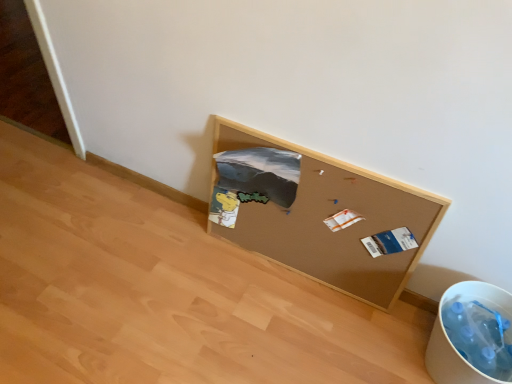
Image resolution: width=512 pixels, height=384 pixels. I want to click on corkboard at lower right, so coord(330,215).

The height and width of the screenshot is (384, 512). What do you see at coordinates (330, 215) in the screenshot?
I see `corkboard at lower right` at bounding box center [330, 215].

The width and height of the screenshot is (512, 384). I want to click on white plastic recycling bin at lower right, so click(472, 335).

What do you see at coordinates (472, 335) in the screenshot?
I see `white plastic recycling bin at lower right` at bounding box center [472, 335].

Where is `corkboard at lower right`? corkboard at lower right is located at coordinates (330, 215).

Is corkboard at lower right to the right of white plastic recycling bin at lower right from the viewer's perspective?

No.

Between corkboard at lower right and white plastic recycling bin at lower right, which one is positioned behind?

corkboard at lower right is behind.

Considering the positions of point (312, 266) and point (462, 303), is point (312, 266) closer or farther from the camera than point (462, 303)?

Point (312, 266).

From the image's perspective, which one is positioned higher, corkboard at lower right or white plastic recycling bin at lower right?

corkboard at lower right, from the image's perspective.

From a real-world perspective, does corkboard at lower right sit lower than white plastic recycling bin at lower right?

Incorrect, from a real-world perspective, corkboard at lower right is higher than white plastic recycling bin at lower right.

Is corkboard at lower right wider than white plastic recycling bin at lower right?

Incorrect, the width of corkboard at lower right does not surpass that of white plastic recycling bin at lower right.

Considering the sizes of corkboard at lower right and white plastic recycling bin at lower right in the image, is corkboard at lower right taller or shorter than white plastic recycling bin at lower right?

corkboard at lower right is taller than white plastic recycling bin at lower right.

Based on the photo, can you confirm if corkboard at lower right is bigger than white plastic recycling bin at lower right?

Correct, corkboard at lower right is larger in size than white plastic recycling bin at lower right.

Is corkboard at lower right outside of white plastic recycling bin at lower right?

corkboard at lower right is positioned outside white plastic recycling bin at lower right.

Is corkboard at lower right next to white plastic recycling bin at lower right?

No, corkboard at lower right is not touching white plastic recycling bin at lower right.

Does corkboard at lower right turn towards white plastic recycling bin at lower right?

No, corkboard at lower right is not oriented towards white plastic recycling bin at lower right.

How different are the orientations of corkboard at lower right and white plastic recycling bin at lower right in degrees?

The angle between the facing direction of corkboard at lower right and the facing direction of white plastic recycling bin at lower right is 0.000394 degrees.

At what (x,y) coordinates should I click in order to perform the action: click on recycling bin on the right of corkboard at lower right. Please return your answer as a coordinate pair (x, y). Looking at the image, I should click on (472, 335).

Considering the relative positions of white plastic recycling bin at lower right and corkboard at lower right in the image provided, is white plastic recycling bin at lower right to the right of corkboard at lower right from the viewer's perspective?

Correct, you'll find white plastic recycling bin at lower right to the right of corkboard at lower right.

Is the position of white plastic recycling bin at lower right more distant than that of corkboard at lower right?

That is False.

Is point (476, 322) positioned in front of point (297, 254)?

Yes.

From the image's perspective, is white plastic recycling bin at lower right positioned above or below corkboard at lower right?

white plastic recycling bin at lower right is situated lower than corkboard at lower right in the image.

Looking at this image, from a real-world perspective, is white plastic recycling bin at lower right above or below corkboard at lower right?

Clearly, from a real-world perspective, white plastic recycling bin at lower right is below corkboard at lower right.

Considering the sizes of objects white plastic recycling bin at lower right and corkboard at lower right in the image provided, who is wider, white plastic recycling bin at lower right or corkboard at lower right?

With larger width is white plastic recycling bin at lower right.

Which of these two, white plastic recycling bin at lower right or corkboard at lower right, stands taller?

corkboard at lower right.

Is white plastic recycling bin at lower right bigger or smaller than corkboard at lower right?

white plastic recycling bin at lower right is smaller than corkboard at lower right.

Is corkboard at lower right located within white plastic recycling bin at lower right?

No, corkboard at lower right is located outside of white plastic recycling bin at lower right.

Is white plastic recycling bin at lower right not close to corkboard at lower right?

No, white plastic recycling bin at lower right is not far away from corkboard at lower right.

Is white plastic recycling bin at lower right looking in the opposite direction of corkboard at lower right?

No.

What's the angular difference between white plastic recycling bin at lower right and corkboard at lower right's facing directions?

0.000394 degrees separate the facing orientations of white plastic recycling bin at lower right and corkboard at lower right.

How distant is white plastic recycling bin at lower right from corkboard at lower right?

white plastic recycling bin at lower right is 33.76 centimeters away from corkboard at lower right.

Locate an element on the screen. Image resolution: width=512 pixels, height=384 pixels. recycling bin on the right of corkboard at lower right is located at coordinates (472, 335).

Find the location of `recycling bin that is on the right side of corkboard at lower right`. recycling bin that is on the right side of corkboard at lower right is located at coordinates (472, 335).

Locate an element on the screen. The height and width of the screenshot is (384, 512). recycling bin below the corkboard at lower right (from the image's perspective) is located at coordinates (472, 335).